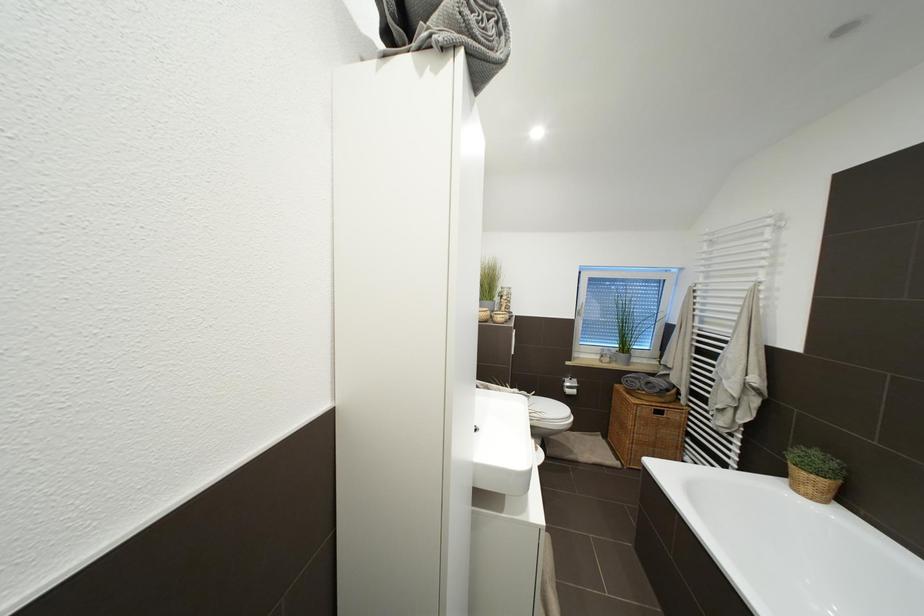
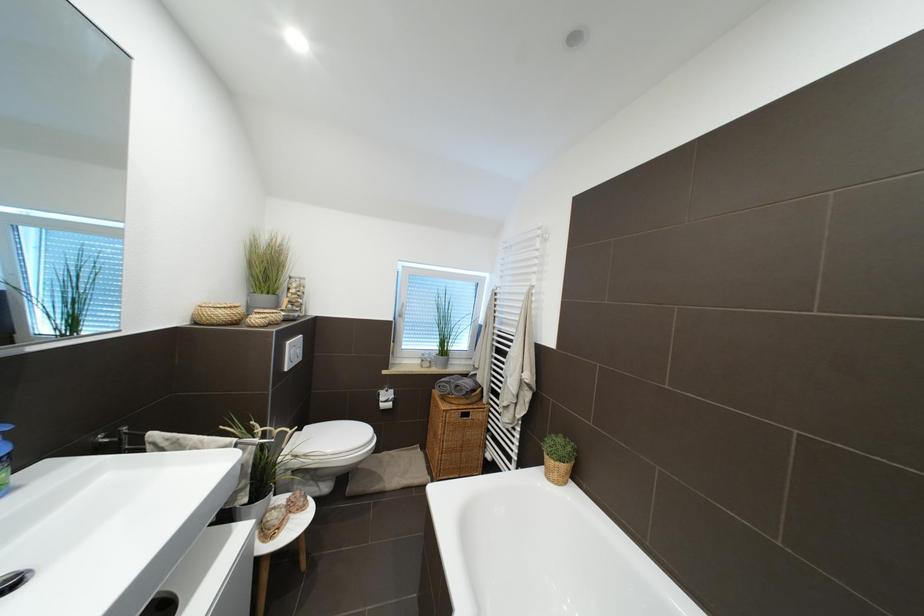
Question: The first image is from the beginning of the video and the second image is from the end. How did the camera likely rotate when shooting the video?

Choices:
 (A) Left
 (B) Right
 (C) Up
 (D) Down

Answer: (B)